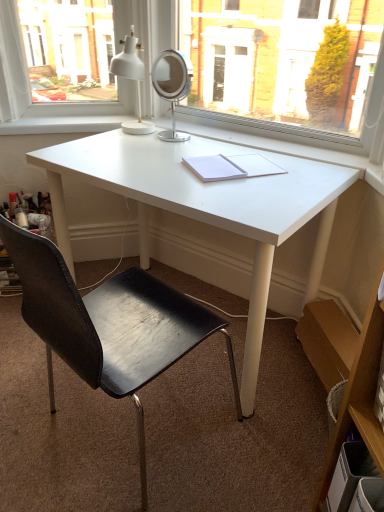
Question: Is white paper notebook at center bigger than white matte desk at center?

Choices:
 (A) yes
 (B) no

Answer: (B)

Question: Can you confirm if white paper notebook at center is positioned to the right of white matte desk at center?

Choices:
 (A) yes
 (B) no

Answer: (A)

Question: Does white paper notebook at center have a smaller size compared to white matte desk at center?

Choices:
 (A) yes
 (B) no

Answer: (A)

Question: Is white paper notebook at center positioned behind white matte desk at center?

Choices:
 (A) no
 (B) yes

Answer: (B)

Question: Is white paper notebook at center outside of white matte desk at center?

Choices:
 (A) no
 (B) yes

Answer: (A)

Question: Is white paper notebook at center aimed at white matte desk at center?

Choices:
 (A) yes
 (B) no

Answer: (A)

Question: Does wooden shelf at right have a greater height compared to white matte desk at center?

Choices:
 (A) yes
 (B) no

Answer: (A)

Question: Is wooden shelf at right aimed at white matte desk at center?

Choices:
 (A) no
 (B) yes

Answer: (A)

Question: Does wooden shelf at right come in front of white matte desk at center?

Choices:
 (A) no
 (B) yes

Answer: (B)

Question: Can you confirm if wooden shelf at right is smaller than white matte desk at center?

Choices:
 (A) yes
 (B) no

Answer: (A)

Question: Is wooden shelf at right outside of white matte desk at center?

Choices:
 (A) no
 (B) yes

Answer: (B)

Question: Considering the relative sizes of wooden shelf at right and white matte desk at center in the image provided, is wooden shelf at right shorter than white matte desk at center?

Choices:
 (A) no
 (B) yes

Answer: (A)

Question: Considering the relative sizes of wooden shelf at right and white matte table lamp at upper center in the image provided, is wooden shelf at right shorter than white matte table lamp at upper center?

Choices:
 (A) no
 (B) yes

Answer: (A)